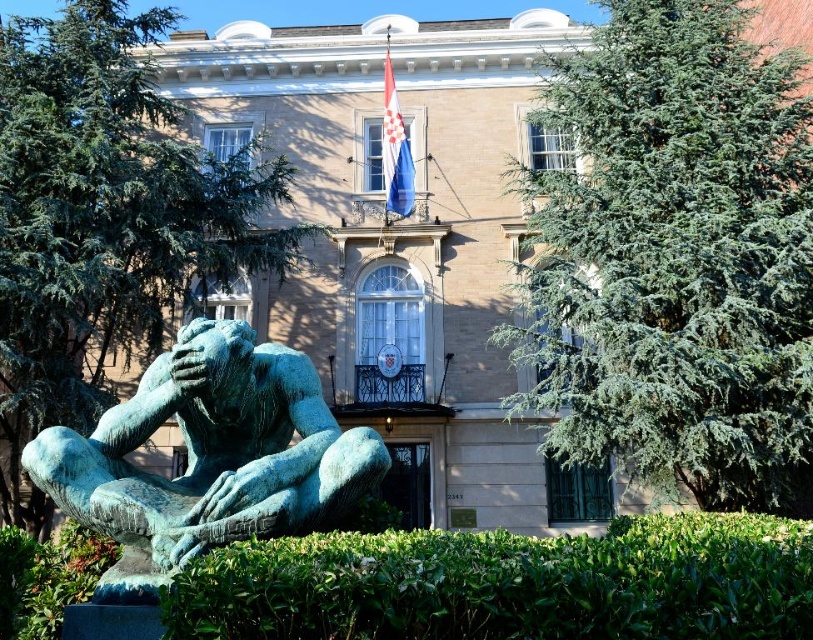
Does green leafy bush at lower center have a lesser width compared to green patina statue at lower left?

No, green leafy bush at lower center is not thinner than green patina statue at lower left.

Between green leafy bush at lower center and green patina statue at lower left, which one appears on the left side from the viewer's perspective?

green patina statue at lower left

The width and height of the screenshot is (813, 640). Describe the element at coordinates (507, 582) in the screenshot. I see `green leafy bush at lower center` at that location.

This screenshot has width=813, height=640. In order to click on green leafy bush at lower center in this screenshot , I will do `click(507, 582)`.

Can you confirm if green needle-like tree at upper right is positioned below green leafy tree at left?

Yes.

Which of these two, green needle-like tree at upper right or green leafy tree at left, stands shorter?

Standing shorter between the two is green needle-like tree at upper right.

Find the location of a particular element. The image size is (813, 640). green needle-like tree at upper right is located at coordinates (675, 257).

Can you confirm if green leafy tree at left is thinner than green leafy bush at lower center?

No.

Does green leafy tree at left have a greater width compared to green leafy bush at lower center?

Yes, green leafy tree at left is wider than green leafy bush at lower center.

Identify the location of green leafy tree at left. The width and height of the screenshot is (813, 640). (103, 221).

This screenshot has height=640, width=813. In order to click on green leafy tree at left in this screenshot , I will do pos(103,221).